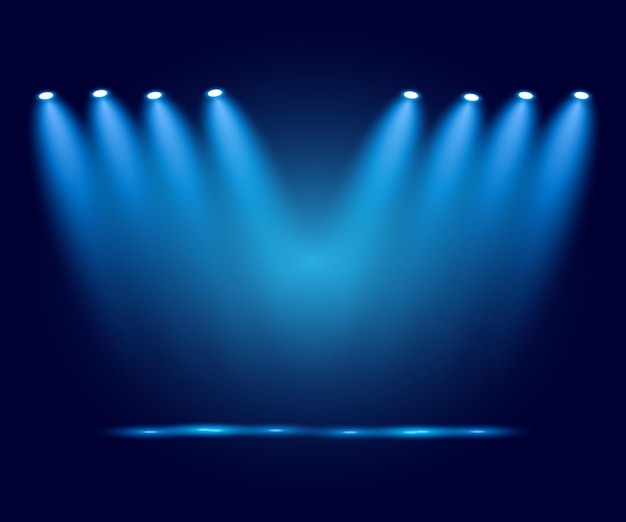
This screenshot has height=522, width=626. I want to click on lights, so click(x=39, y=90), click(x=86, y=102), click(x=151, y=98), click(x=217, y=96), click(x=409, y=101), click(x=479, y=104), click(x=518, y=104), click(x=586, y=98).